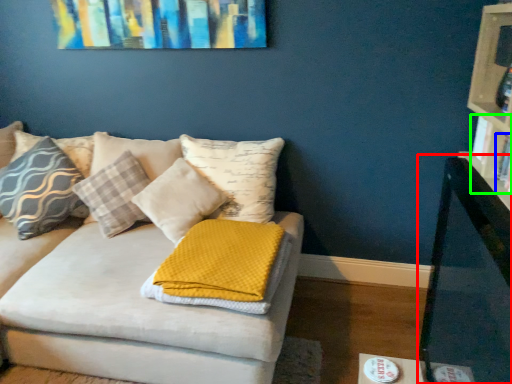
Question: Which object is positioned farthest from table (highlighted by a red box)? Select from book (highlighted by a blue box) and book (highlighted by a green box).

Choices:
 (A) book
 (B) book

Answer: (A)